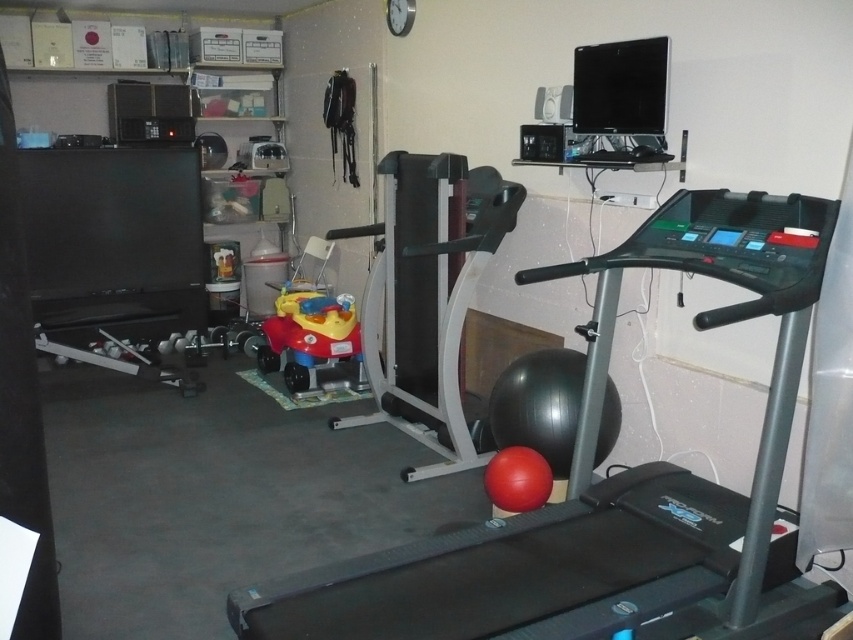
Question: Which point appears farthest from the camera in this image?

Choices:
 (A) (300, 289)
 (B) (802, 308)

Answer: (A)

Question: Which object is closer to the camera taking this photo?

Choices:
 (A) black rubber treadmill at center
 (B) rubberized plastic toy car at center

Answer: (A)

Question: Considering the relative positions of black rubber treadmill at center and rubberized plastic toy car at center in the image provided, where is black rubber treadmill at center located with respect to rubberized plastic toy car at center?

Choices:
 (A) above
 (B) below

Answer: (B)

Question: Does black rubber treadmill at center appear on the left side of rubberized plastic toy car at center?

Choices:
 (A) yes
 (B) no

Answer: (B)

Question: Is black rubber treadmill at center smaller than rubberized plastic toy car at center?

Choices:
 (A) yes
 (B) no

Answer: (B)

Question: Which of the following is the closest to the observer?

Choices:
 (A) (788, 412)
 (B) (294, 378)

Answer: (A)